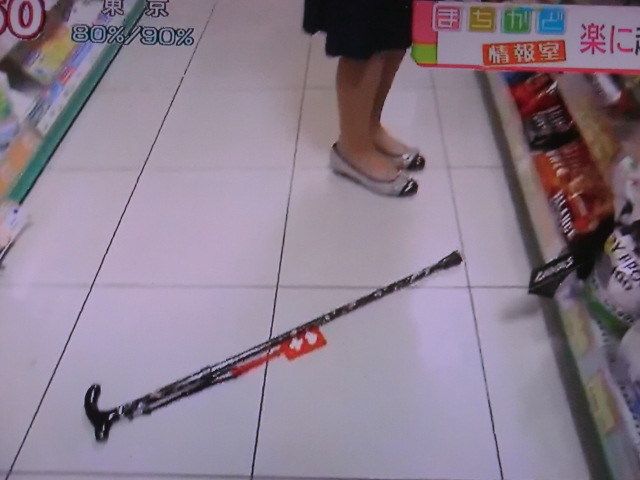
Locate an element on the screen. rubber stopper is located at coordinates (456, 256).